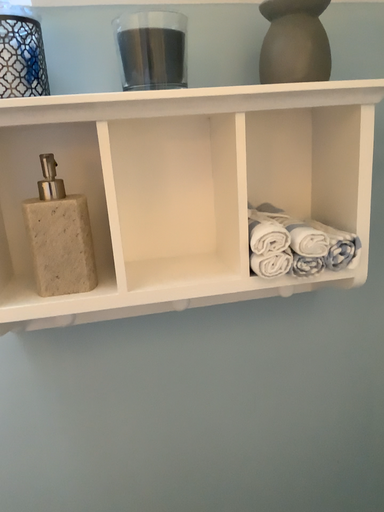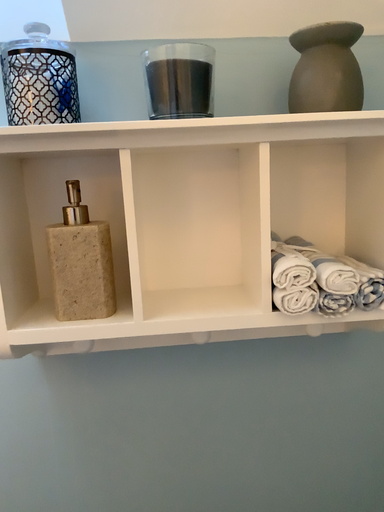
Question: Which way did the camera rotate in the video?

Choices:
 (A) rotated left
 (B) rotated right

Answer: (A)